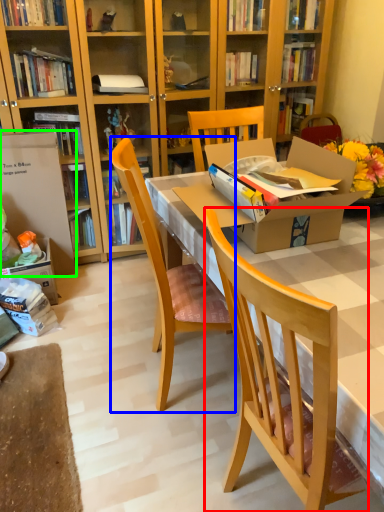
Question: Which is farther away from chair (highlighted by a red box)? chair (highlighted by a blue box) or box (highlighted by a green box)?

Choices:
 (A) chair
 (B) box

Answer: (B)